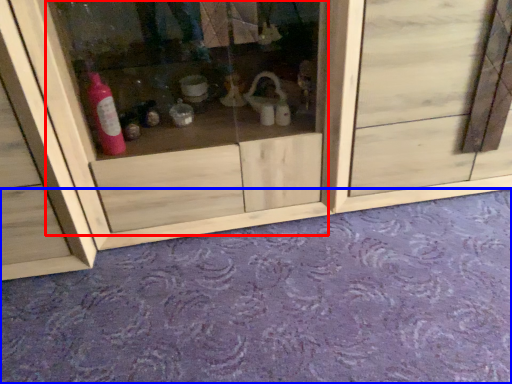
Question: Which of the following is the closest to the observer, glass door (highlighted by a red box) or plain (highlighted by a blue box)?

Choices:
 (A) glass door
 (B) plain

Answer: (B)